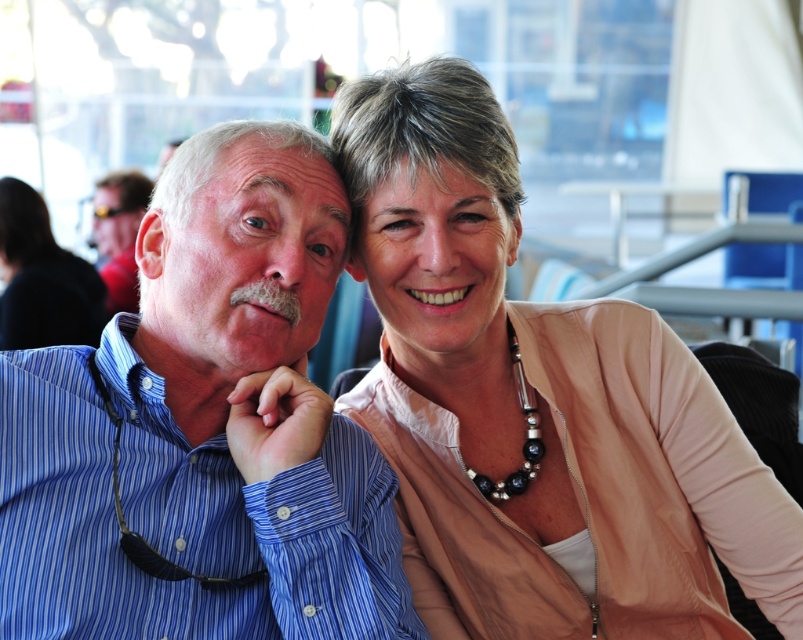
Is point (499, 438) closer to viewer compared to point (90, 600)?

No, (499, 438) is behind (90, 600).

Who is shorter, pale beige sweater at center or blue striped shirt at left?

blue striped shirt at left is shorter.

Which is behind, point (561, 634) or point (249, 472)?

The point (561, 634) is more distant.

Find the location of `pale beige sweater at center`. pale beige sweater at center is located at coordinates (536, 404).

Who is more forward, (155, 464) or (35, 278)?

Point (155, 464)

Does blue striped shirt at left have a lesser width compared to matte beige sweater at upper right?

Indeed, blue striped shirt at left has a lesser width compared to matte beige sweater at upper right.

Who is more forward, [286,499] or [47,296]?

Point [286,499] is in front.

Identify the location of blue striped shirt at left. (204, 428).

Is blue striped shirt at left to the right of matte blue shirt at left from the viewer's perspective?

Indeed, blue striped shirt at left is positioned on the right side of matte blue shirt at left.

Can you confirm if blue striped shirt at left is wider than matte blue shirt at left?

Indeed, blue striped shirt at left has a greater width compared to matte blue shirt at left.

In the scene shown: Who is more forward, (109,611) or (139,211)?

Point (109,611) is more forward.

I want to click on blue striped shirt at left, so pos(204,428).